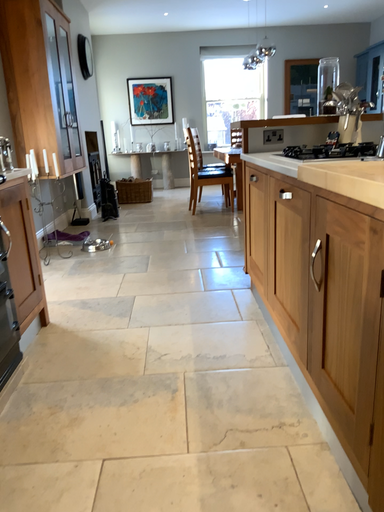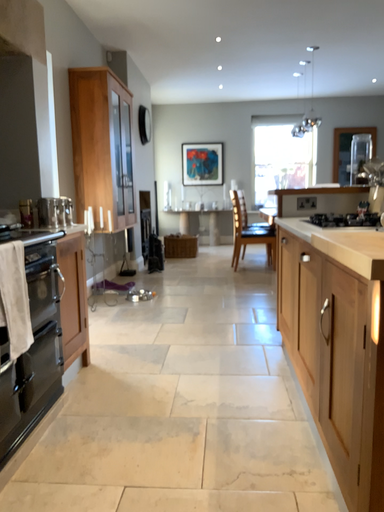
Question: How did the camera likely rotate when shooting the video?

Choices:
 (A) rotated downward
 (B) rotated upward

Answer: (B)